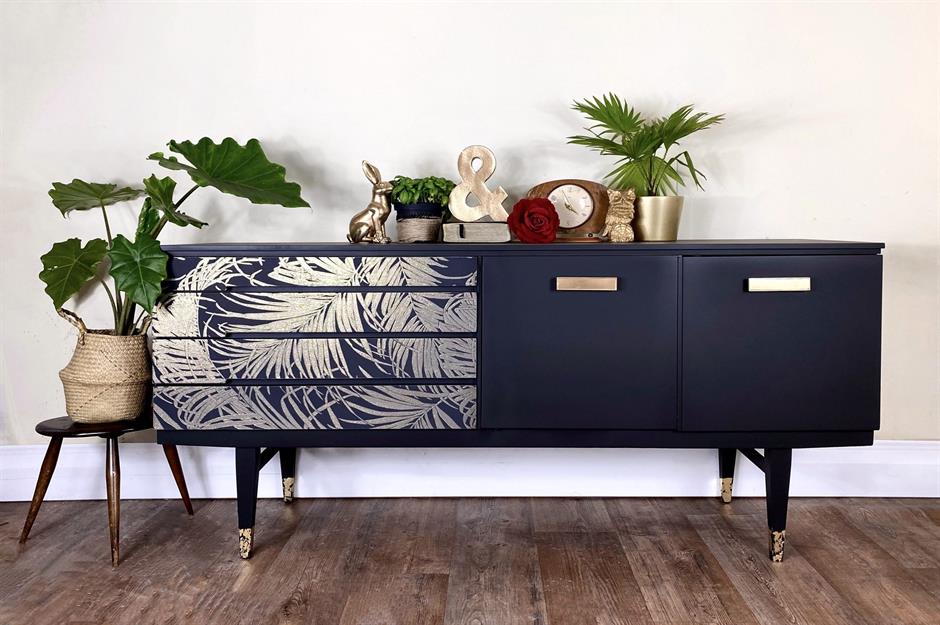
Locate an element on the screen. Image resolution: width=940 pixels, height=625 pixels. plant is located at coordinates (152, 254).